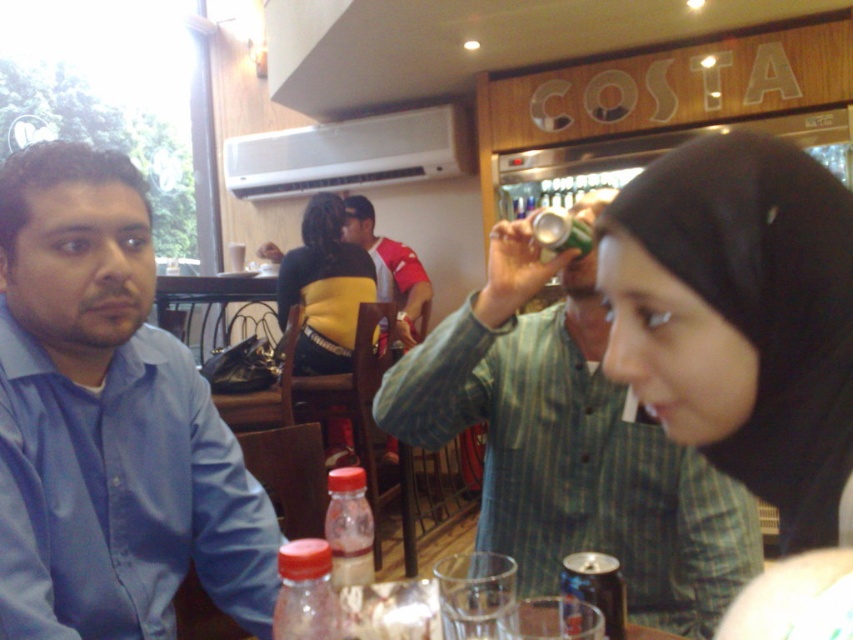
Between translucent plastic bottle at center and metallic silver can at center, which one appears on the right side from the viewer's perspective?

metallic silver can at center is more to the right.

Which of these two, translucent plastic bottle at center or metallic silver can at center, stands shorter?

Standing shorter between the two is metallic silver can at center.

Is point (337, 554) positioned after point (561, 593)?

No, (337, 554) is in front of (561, 593).

Where is `translucent plastic bottle at center`? The image size is (853, 640). translucent plastic bottle at center is located at coordinates click(349, 528).

Between point (405, 273) and point (280, 602), which one is positioned behind?

The point (405, 273) is more distant.

Between point (412, 332) and point (283, 636), which one is positioned in front?

Point (283, 636)

Between point (337, 448) and point (338, 616), which one is positioned in front?

Point (338, 616) is more forward.

Find the location of a particular element. red shirt at center is located at coordinates (390, 269).

Does translucent plastic bottle at lower left have a greater width compared to translucent plastic bottle at center?

Indeed, translucent plastic bottle at lower left has a greater width compared to translucent plastic bottle at center.

What do you see at coordinates (305, 593) in the screenshot? This screenshot has width=853, height=640. I see `translucent plastic bottle at lower left` at bounding box center [305, 593].

Does point (291, 557) lie behind point (352, 502)?

That is False.

Locate an element on the screen. This screenshot has height=640, width=853. translucent plastic bottle at lower left is located at coordinates (305, 593).